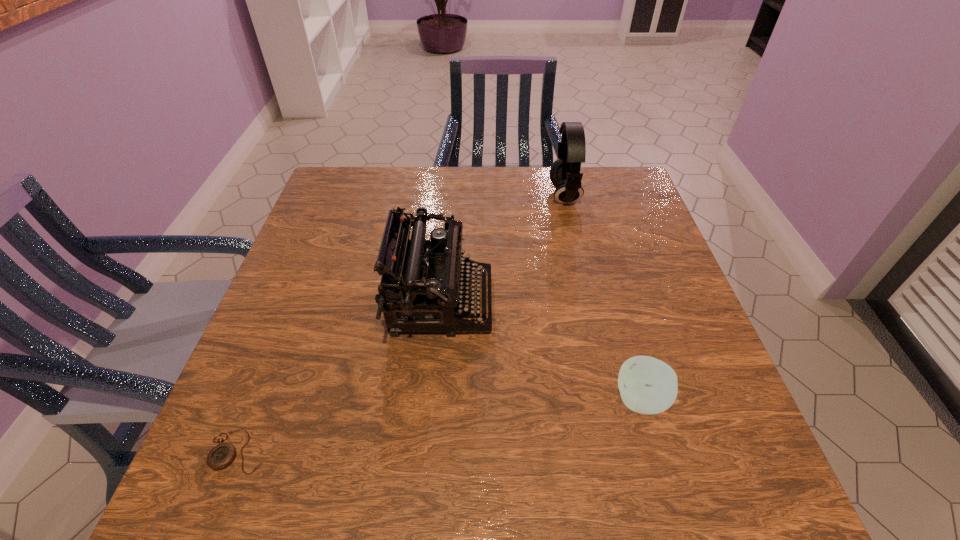
Identify the location of the farthest object. The image size is (960, 540). (565, 175).

Where is `the third object from right to left`? Image resolution: width=960 pixels, height=540 pixels. the third object from right to left is located at coordinates (436, 284).

At what (x,y) coordinates should I click in order to perform the action: click on typewriter. Please return your answer as a coordinate pair (x, y). Looking at the image, I should click on (436, 284).

Locate an element on the screen. apple is located at coordinates (647, 385).

The width and height of the screenshot is (960, 540). In order to click on the second shortest object in this screenshot , I will do `click(647, 385)`.

This screenshot has width=960, height=540. I want to click on the nearest object, so click(222, 455).

Image resolution: width=960 pixels, height=540 pixels. In order to click on the leftmost object in this screenshot , I will do `click(222, 455)`.

Find the location of a particular element. Image resolution: width=960 pixels, height=540 pixels. free space located 0.400m on the ear cups of the earphone is located at coordinates (416, 195).

Locate an element on the screen. The width and height of the screenshot is (960, 540). vacant space located 0.240m on the ear cups of the earphone is located at coordinates (469, 195).

At what (x,y) coordinates should I click in order to perform the action: click on free space located on the ear cups of the earphone. Please return your answer as a coordinate pair (x, y). Looking at the image, I should click on (436, 195).